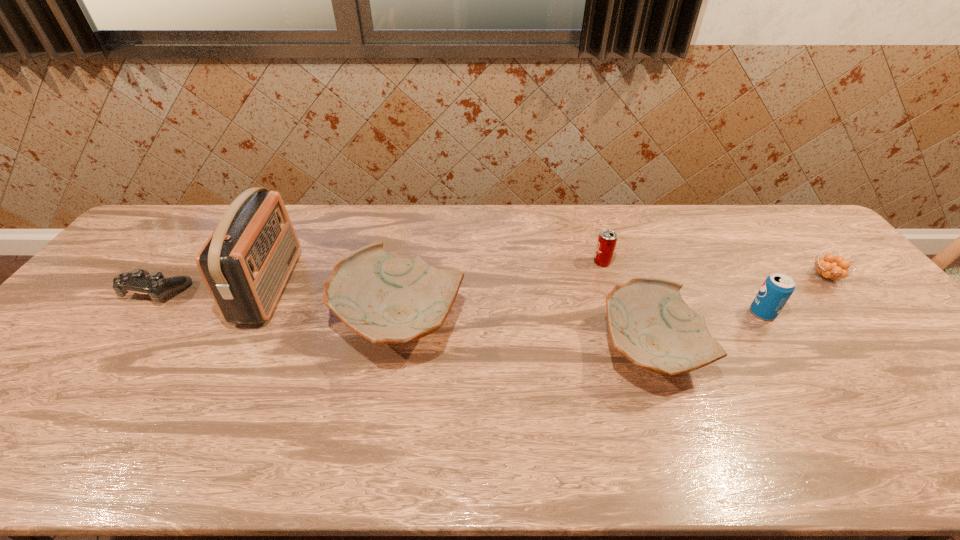
Locate an element on the screen. This screenshot has height=540, width=960. free space located on the back of the right pottery is located at coordinates (612, 244).

Image resolution: width=960 pixels, height=540 pixels. Identify the location of vacant space located on the back of the control. click(205, 229).

Locate an element on the screen. Image resolution: width=960 pixels, height=540 pixels. free space located on the left of the rightmost object is located at coordinates (789, 276).

Find the location of a particular element. Image resolution: width=960 pixels, height=540 pixels. free point located on the back of the sixth object from left to right is located at coordinates [705, 222].

You are a GUI agent. You are given a task and a screenshot of the screen. Output one action in this format:
    pyautogui.click(x=<x>, y=<y>)
    Task: Click on the vacant region located 0.090m on the back of the beer can
    This screenshot has width=960, height=540.
    Given the screenshot: What is the action you would take?
    pyautogui.click(x=595, y=239)

The width and height of the screenshot is (960, 540). What are the coordinates of `vacant space located 0.220m on the front-facing side of the second object from left to right` in the screenshot? It's located at [364, 287].

Where is `object that is at the near edge`? The image size is (960, 540). object that is at the near edge is located at coordinates (650, 324).

What are the coordinates of `object located at the left edge` in the screenshot? It's located at (157, 286).

Where is `object present at the right edge`? The height and width of the screenshot is (540, 960). object present at the right edge is located at coordinates (829, 267).

In the image, there is a desktop. Find the location of `vacant space at the far edge`. vacant space at the far edge is located at coordinates (206, 221).